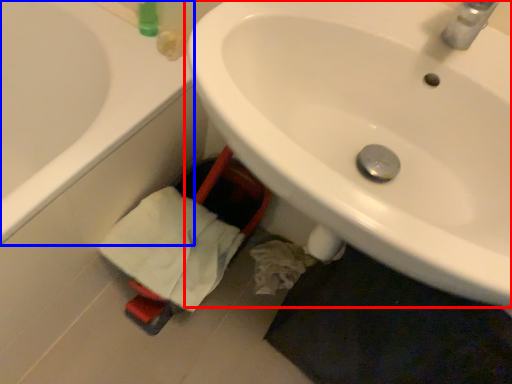
Question: Which object appears farthest to the camera in this image, sink (highlighted by a red box) or bathtub (highlighted by a blue box)?

Choices:
 (A) sink
 (B) bathtub

Answer: (B)